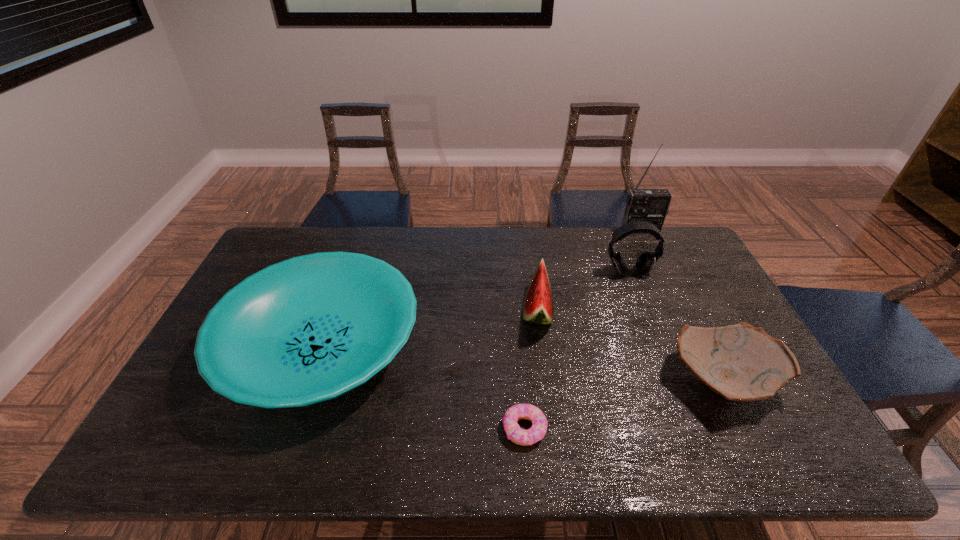
Locate an element on the screen. object that is the second closest to the fifth tallest object is located at coordinates (645, 262).

This screenshot has height=540, width=960. Find the location of `free space that satisfies the following two spatial constraints: 1. on the ear cups of the second tallest object; 2. on the right side of the second shortest object`. free space that satisfies the following two spatial constraints: 1. on the ear cups of the second tallest object; 2. on the right side of the second shortest object is located at coordinates (671, 381).

What are the coordinates of `vacant space that satisfies the following two spatial constraints: 1. on the ear cups of the fifth nearest object; 2. on the right side of the pottery` in the screenshot? It's located at (671, 381).

You are a GUI agent. You are given a task and a screenshot of the screen. Output one action in this format:
    pyautogui.click(x=<x>, y=<y>)
    Task: Click on the blank space that satisfies the following two spatial constraints: 1. on the display of the fifth tallest object; 2. on the right side of the farthest object
    
    Given the screenshot: What is the action you would take?
    pyautogui.click(x=712, y=381)

This screenshot has width=960, height=540. I want to click on blank area in the image that satisfies the following two spatial constraints: 1. on the display of the fifth tallest object; 2. on the left side of the tallest object, so click(712, 381).